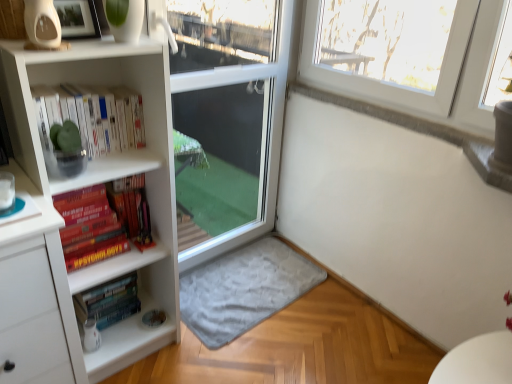
Question: From their relative heights in the image, would you say hardcover books at lower left, the 1th book when ordered from bottom to top, is taller or shorter than white glossy bookshelf at upper left?

Choices:
 (A) tall
 (B) short

Answer: (A)

Question: Considering their positions, is hardcover books at lower left, the 1th book when ordered from bottom to top, located in front of or behind white glossy bookshelf at upper left?

Choices:
 (A) behind
 (B) front

Answer: (A)

Question: Based on their relative distances, which object is farther from the transparent glass screen door at center?

Choices:
 (A) hardcover psychology book at left, which is the 1th book in top-to-bottom order
 (B) gray soft rug at lower center
 (C) hardcover books at lower left, which appears as the 2th book when viewed from the top
 (D) white glossy bookshelf at upper left

Answer: (C)

Question: Which object is the farthest from the transparent glass screen door at center?

Choices:
 (A) hardcover books at lower left, the 1th book when ordered from bottom to top
 (B) gray soft rug at lower center
 (C) white glossy bookshelf at upper left
 (D) hardcover psychology book at left, which is the 2th book from bottom to top

Answer: (A)